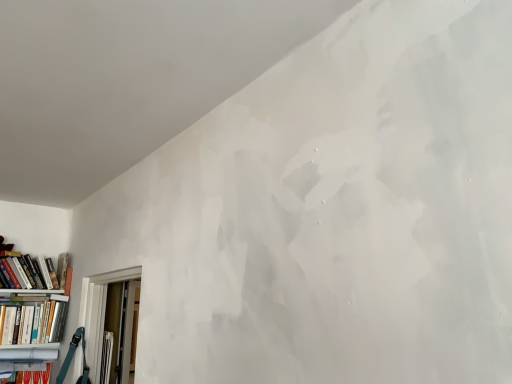
Question: Does matte white bookcase at lower left have a lesser width compared to hardcover book at left, the 2th book ordered from the bottom?

Choices:
 (A) no
 (B) yes

Answer: (A)

Question: Is matte white bookcase at lower left oriented towards hardcover book at left, the 2th book ordered from the bottom?

Choices:
 (A) yes
 (B) no

Answer: (B)

Question: Is matte white bookcase at lower left closer to the viewer compared to hardcover book at left, the 2th book ordered from the bottom?

Choices:
 (A) no
 (B) yes

Answer: (B)

Question: Is matte white bookcase at lower left at the right side of hardcover book at left, the 2th book ordered from the bottom?

Choices:
 (A) no
 (B) yes

Answer: (B)

Question: Is matte white bookcase at lower left bigger than hardcover book at left, the 1th book positioned from the top?

Choices:
 (A) no
 (B) yes

Answer: (B)

Question: Does matte white bookcase at lower left have a greater width compared to hardcover book at left, the 1th book positioned from the top?

Choices:
 (A) yes
 (B) no

Answer: (A)

Question: Is hardcover book at left, the 2th book ordered from the bottom, with matte white bookcase at lower left?

Choices:
 (A) yes
 (B) no

Answer: (B)

Question: Considering the relative sizes of hardcover book at left, the 1th book positioned from the top, and matte white bookcase at lower left in the image provided, is hardcover book at left, the 1th book positioned from the top, taller than matte white bookcase at lower left?

Choices:
 (A) no
 (B) yes

Answer: (A)

Question: Considering the relative sizes of hardcover book at left, the 2th book ordered from the bottom, and matte white bookcase at lower left in the image provided, is hardcover book at left, the 2th book ordered from the bottom, wider than matte white bookcase at lower left?

Choices:
 (A) no
 (B) yes

Answer: (A)

Question: Is hardcover book at left, the 1th book positioned from the top, at the left side of matte white bookcase at lower left?

Choices:
 (A) no
 (B) yes

Answer: (B)

Question: Is hardcover book at left, the 2th book ordered from the bottom, facing towards matte white bookcase at lower left?

Choices:
 (A) yes
 (B) no

Answer: (B)

Question: Would you say hardcover book at left, the 1th book positioned from the top, is outside matte white bookcase at lower left?

Choices:
 (A) yes
 (B) no

Answer: (A)

Question: From a real-world perspective, is hardcover book at left, placed as the 2th book when sorted from top to bottom, over matte white bookcase at lower left?

Choices:
 (A) yes
 (B) no

Answer: (A)